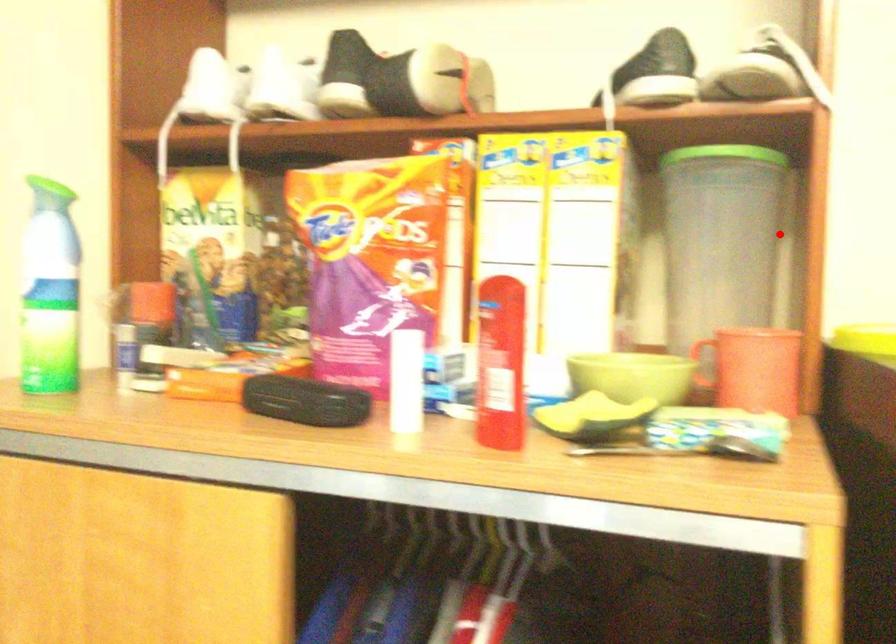
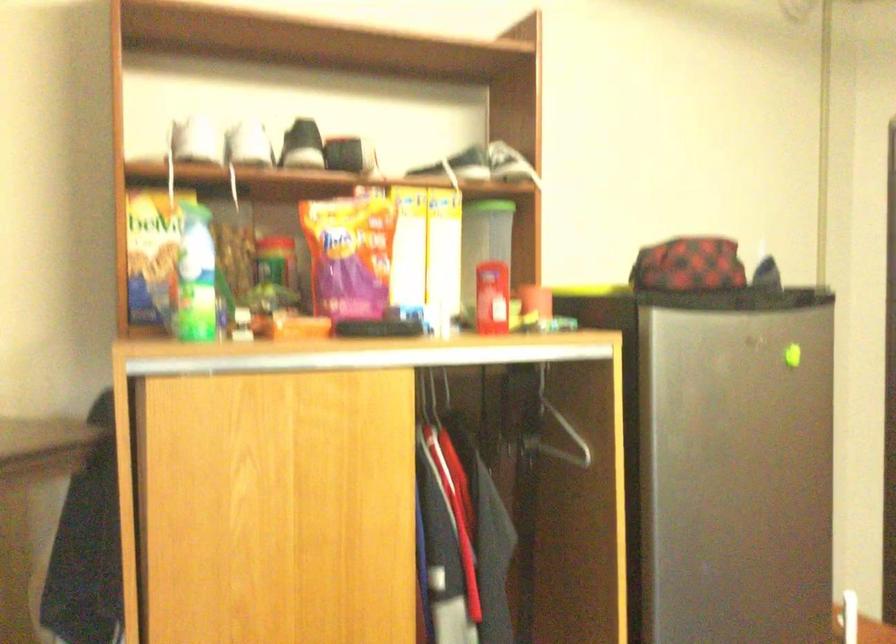
Question: A red point is marked in image1. In image2, is the corresponding 3D point closer to the camera or farther? Reply with the corresponding letter.

Choices:
 (A) The corresponding 3D point is closer.
 (B) The corresponding 3D point is farther.

Answer: (B)